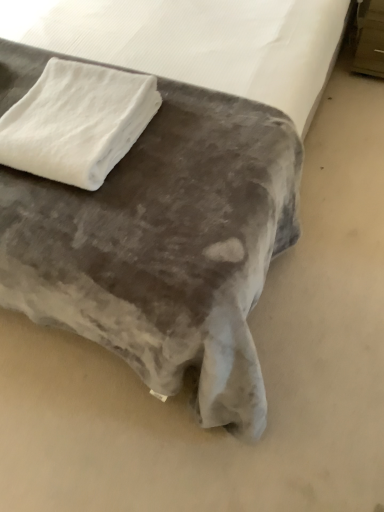
Describe the element at coordinates (77, 122) in the screenshot. I see `white soft towel at upper left` at that location.

Locate an element on the screen. The image size is (384, 512). white soft towel at upper left is located at coordinates (77, 122).

Where is `white soft towel at upper left`? The width and height of the screenshot is (384, 512). white soft towel at upper left is located at coordinates (77, 122).